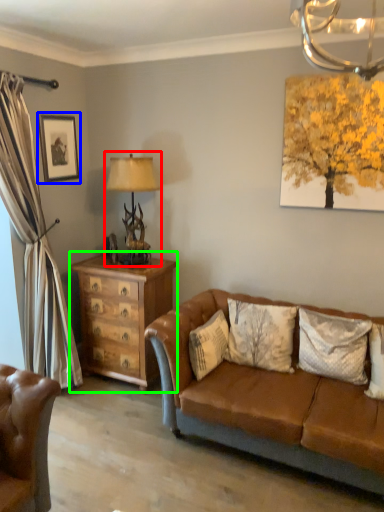
Question: Based on their relative distances, which object is nearer to table lamp (highlighted by a red box)? Choose from picture frame (highlighted by a blue box) and chest of drawers (highlighted by a green box).

Choices:
 (A) picture frame
 (B) chest of drawers

Answer: (B)